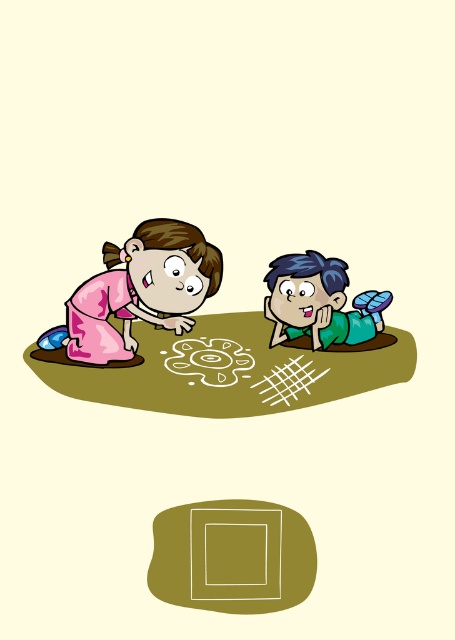
You are a parent watching your children play. You notice the smooth olive square at center and the pink fabric dress at left. Which object is positioned closer to the right side of the scene?

The smooth olive square at center is positioned to the right of the pink fabric dress at left, so it is closer to the right side of the scene.

You are a photographer trying to capture a photo of both the pink fabric dress at left and the green matte shirt at center. Since you want to ensure both are in focus, you need to know which object is taller. Can you determine which one is taller?

The pink fabric dress at left is much taller than the green matte shirt at center, so you should adjust your camera settings to focus on the pink fabric dress at left first.

You are a photographer taking a picture of the scene. You want to ensure the green matte shirt at center and the white chalk drawing at center are both in focus. Since you can only focus on one object, which one should you choose to ensure the other is also in focus? Explain based on their positions.

The green matte shirt at center is to the right of the white chalk drawing at center. Since they are both at the same distance from the camera along the same plane, focusing on either one will keep both in focus.